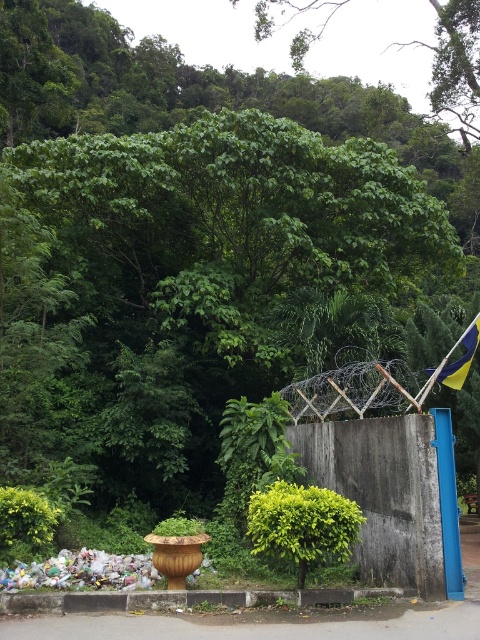
Question: Where is green leafy tree at upper center located in relation to plastic trash at lower left in the image?

Choices:
 (A) left
 (B) right

Answer: (B)

Question: Which of the following is the closest to the observer?

Choices:
 (A) (140, 579)
 (B) (471, 330)
 (C) (458, 38)

Answer: (B)

Question: Does green leafy tree at upper center have a smaller size compared to plastic trash at lower left?

Choices:
 (A) no
 (B) yes

Answer: (A)

Question: Which object appears closest to the camera in this image?

Choices:
 (A) plastic trash at lower left
 (B) yellow fabric flag at right

Answer: (A)

Question: Which of the following is the farthest from the observer?

Choices:
 (A) green leafy tree at upper center
 (B) yellow fabric flag at right

Answer: (A)

Question: From the image, what is the correct spatial relationship of green leafy tree at upper center in relation to yellow fabric flag at right?

Choices:
 (A) right
 (B) left

Answer: (A)